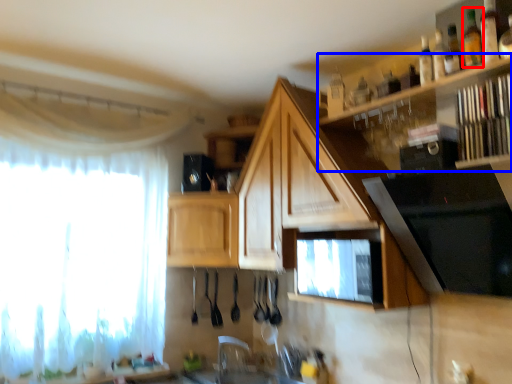
Question: Which point is further to the camera, bottle (highlighted by a red box) or shelf (highlighted by a blue box)?

Choices:
 (A) bottle
 (B) shelf

Answer: (A)